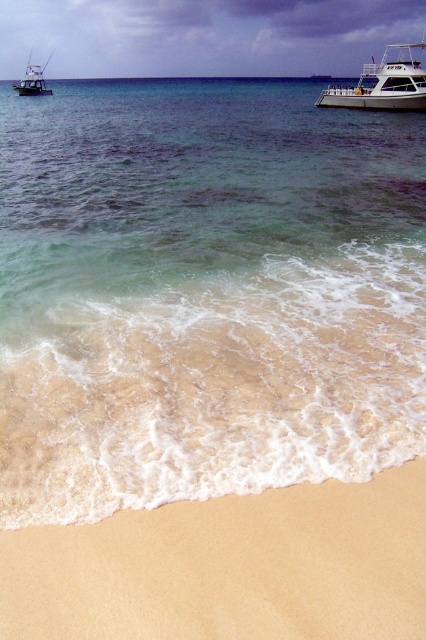
Question: Which point is closer to the camera taking this photo?

Choices:
 (A) (138, 561)
 (B) (368, 97)

Answer: (A)

Question: Is clear water at center closer to camera compared to brushed metal boat at upper left?

Choices:
 (A) yes
 (B) no

Answer: (A)

Question: Which point is farther to the camera?

Choices:
 (A) (22, 80)
 (B) (374, 97)

Answer: (A)

Question: Which point appears closest to the camera in this image?

Choices:
 (A) (25, 90)
 (B) (379, 72)

Answer: (B)

Question: Is clear water at center below brushed metal boat at upper left?

Choices:
 (A) yes
 (B) no

Answer: (A)

Question: Can you confirm if beige sandy beach at lower center is smaller than brushed metal boat at upper left?

Choices:
 (A) no
 (B) yes

Answer: (B)